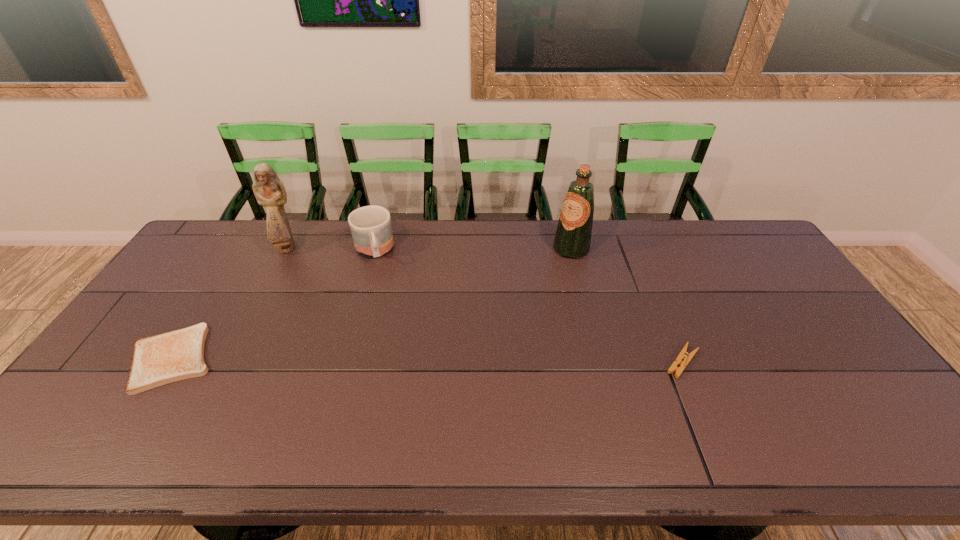
I want to click on free spot on the desktop that is between the shortest object and the clothespin and is positioned on the front-facing side of the second object from right to left, so click(x=466, y=360).

The image size is (960, 540). Identify the location of vacant space on the desktop that is between the toast and the clothespin and is positioned on the front-facing side of the figurine. (392, 360).

Where is `vacant spot on the desktop that is between the shortest object and the rightmost object and is positioned on the side with the handle of the mug`? vacant spot on the desktop that is between the shortest object and the rightmost object and is positioned on the side with the handle of the mug is located at coordinates (397, 360).